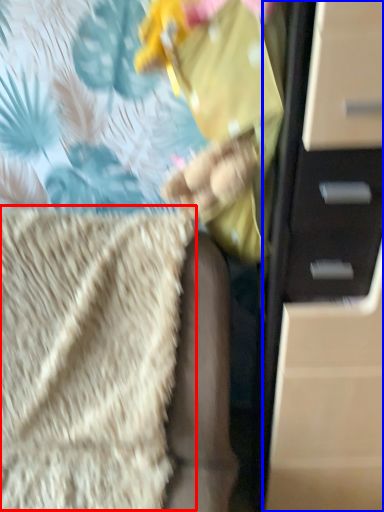
Question: Which point is closer to the camera, blanket (highlighted by a red box) or chest of drawers (highlighted by a blue box)?

Choices:
 (A) blanket
 (B) chest of drawers

Answer: (A)